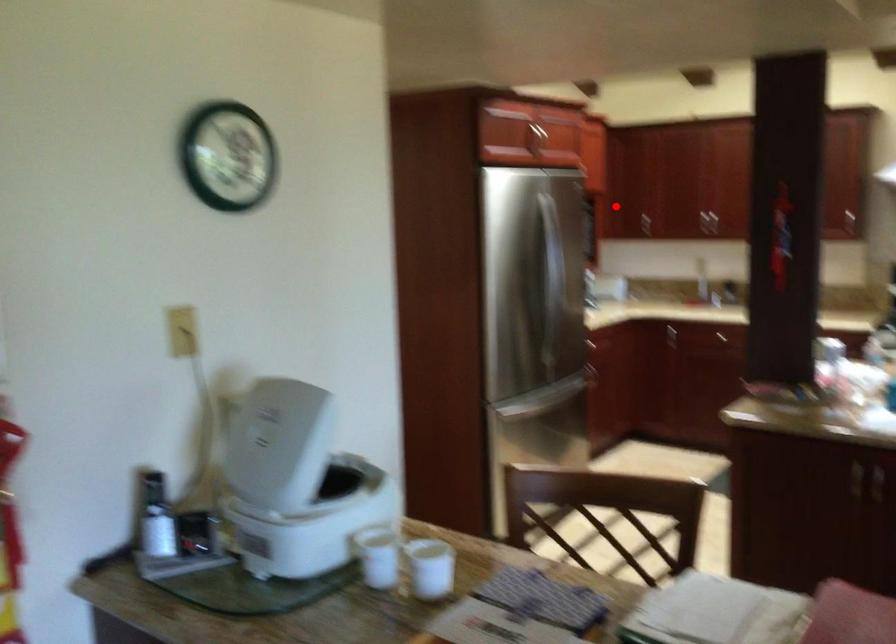
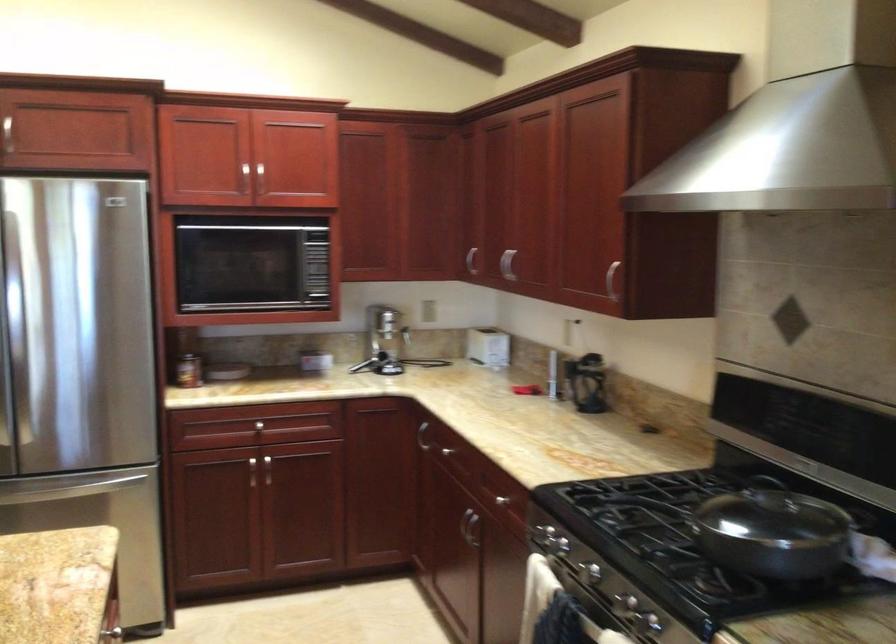
Where in the second image is the point corresponding to the highlighted location from the first image?

(471, 261)